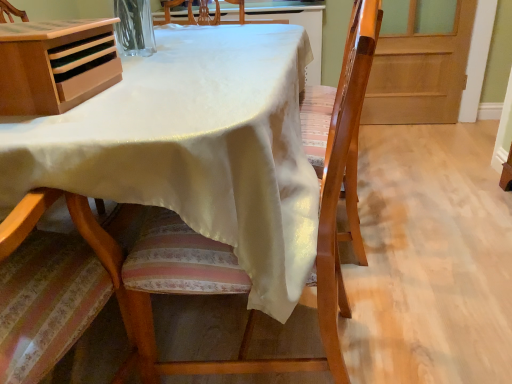
Question: Is wooden chair at center wider or thinner than light brown wood desk at upper left?

Choices:
 (A) wide
 (B) thin

Answer: (A)

Question: Based on their sizes in the image, would you say wooden chair at center is bigger or smaller than light brown wood desk at upper left?

Choices:
 (A) small
 (B) big

Answer: (B)

Question: Estimate the real-world distances between objects in this image. Which object is closer to the wooden chair at center?

Choices:
 (A) white satin tablecloth at center
 (B) light brown wood desk at upper left
 (C) wooden screen door at right

Answer: (A)

Question: Based on their relative distances, which object is farther from the white satin tablecloth at center?

Choices:
 (A) wooden screen door at right
 (B) light brown wood desk at upper left
 (C) wooden chair at center

Answer: (A)